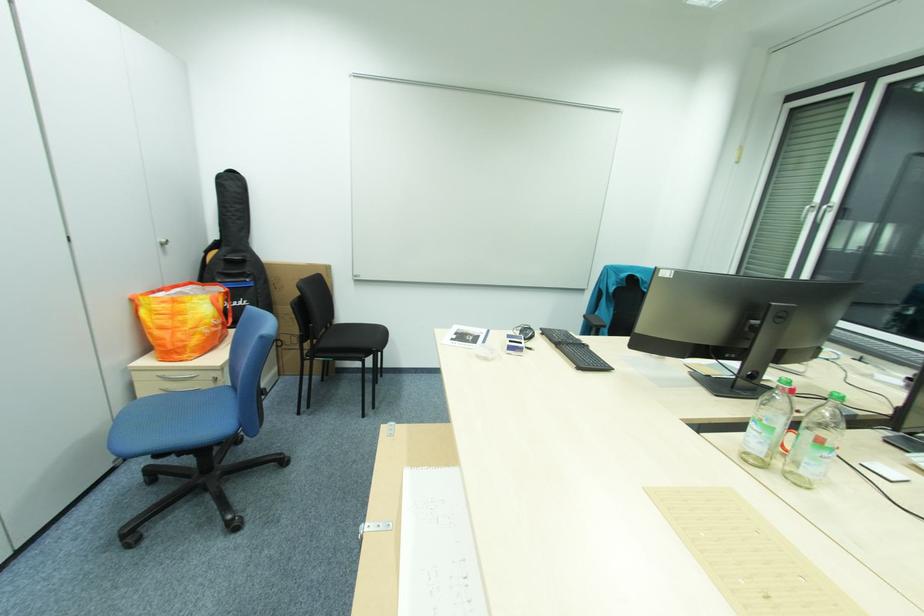
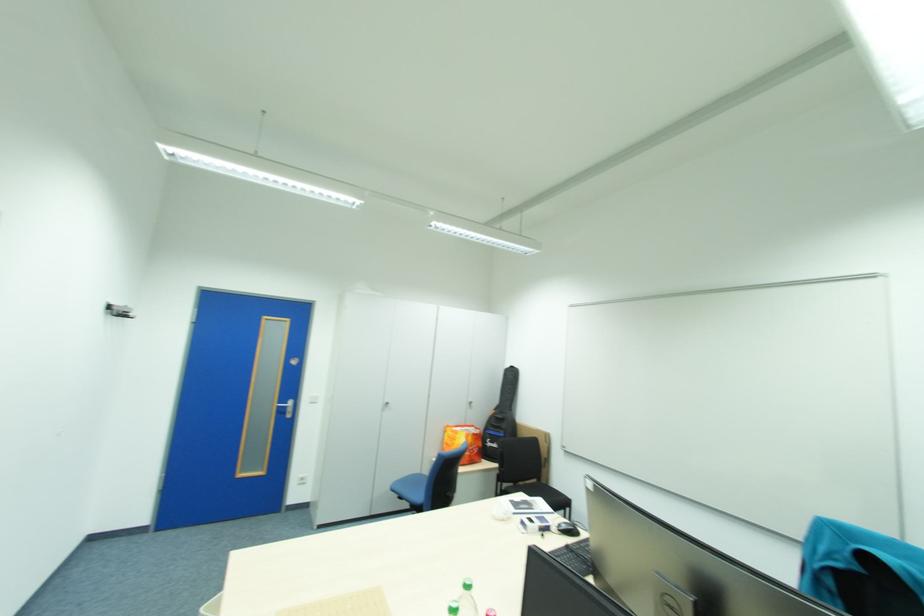
In the second image, find the point that corresponds to [171,244] in the first image.

(479, 403)